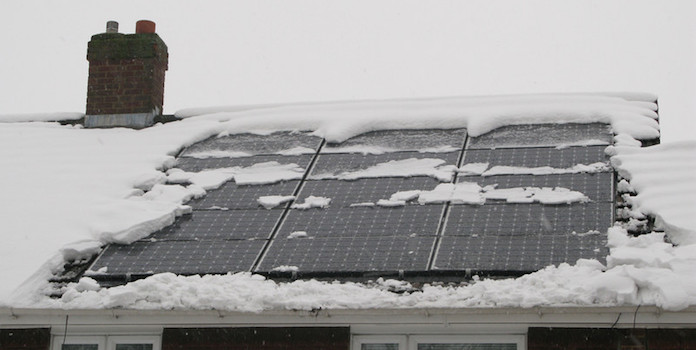
The image size is (696, 350). I want to click on the top of two windows on the right, so click(x=475, y=338), click(x=383, y=338).